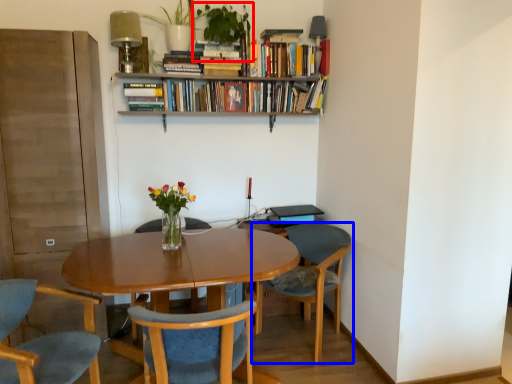
Question: Which of the following is the closest to the observer, houseplant (highlighted by a red box) or chair (highlighted by a blue box)?

Choices:
 (A) houseplant
 (B) chair

Answer: (B)